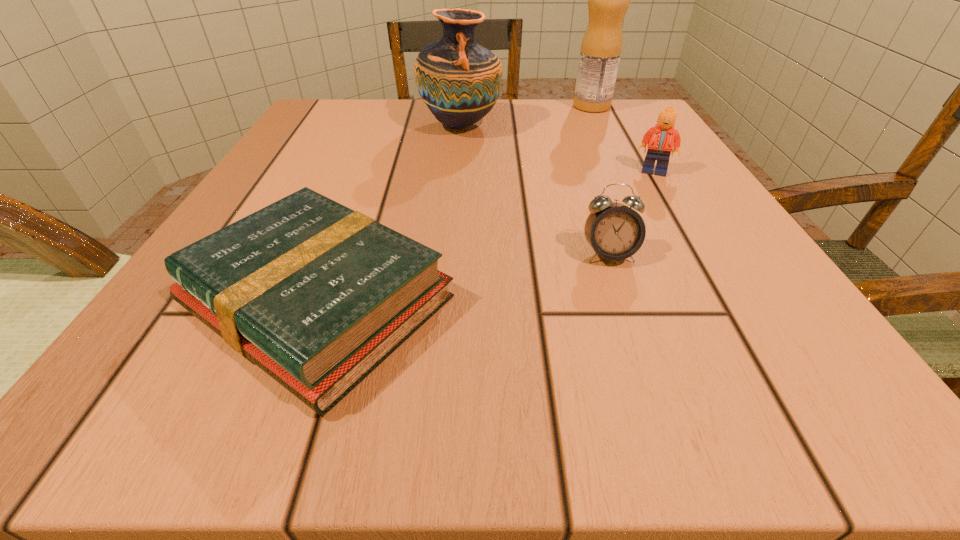
In order to click on object present at the far right corner in this screenshot , I will do `click(608, 0)`.

In the image, there is a desktop. In order to click on vacant space at the far edge in this screenshot , I will do `click(575, 120)`.

Locate an element on the screen. vacant space at the near edge of the desktop is located at coordinates (569, 360).

The image size is (960, 540). I want to click on free space at the left edge of the desktop, so 308,171.

Locate an element on the screen. The height and width of the screenshot is (540, 960). vacant space at the right edge of the desktop is located at coordinates (704, 303).

At what (x,y) coordinates should I click in order to perform the action: click on vacant area at the far left corner of the desktop. Please return your answer as a coordinate pair (x, y). The width and height of the screenshot is (960, 540). Looking at the image, I should click on (367, 102).

This screenshot has width=960, height=540. What are the coordinates of `vacant space at the far right corner of the desktop` in the screenshot? It's located at (631, 101).

The height and width of the screenshot is (540, 960). Find the location of `blank region between the hardback book and the tallest object`. blank region between the hardback book and the tallest object is located at coordinates (455, 204).

Find the location of `free space between the Lego and the shortest object`. free space between the Lego and the shortest object is located at coordinates (486, 237).

In order to click on vacant area that lies between the tallest object and the pottery in this screenshot , I will do `click(526, 116)`.